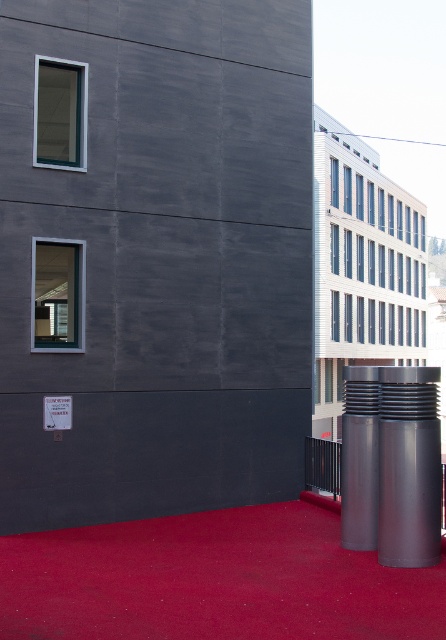
Which is in front, point (399, 515) or point (364, 522)?

Positioned in front is point (399, 515).

Does polished metallic cylinder at center have a lesser width compared to silver metallic pillar at center?

No.

What are the coordinates of `polished metallic cylinder at center` in the screenshot? It's located at (408, 467).